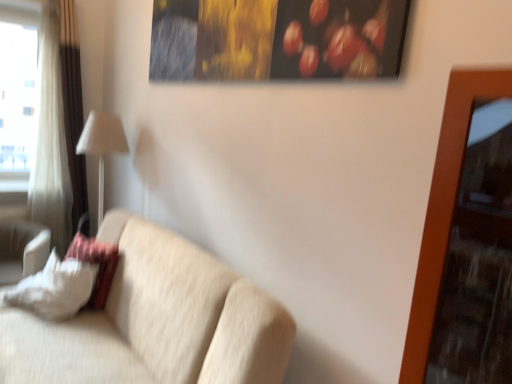
Question: In terms of width, does white fabric curtain at left look wider or thinner when compared to beige fabric couch at center?

Choices:
 (A) wide
 (B) thin

Answer: (B)

Question: Considering the positions of white fabric curtain at left and beige fabric couch at center in the image, is white fabric curtain at left bigger or smaller than beige fabric couch at center?

Choices:
 (A) small
 (B) big

Answer: (A)

Question: Based on their relative distances, which object is nearer to the transparent glass window at left?

Choices:
 (A) white fabric curtain at left
 (B) white fabric lampshade at left
 (C) white fabric pillow at left, the 1th pillow from the right
 (D) beige fabric couch at center
 (E) white soft pillow at lower left, the 2th pillow viewed from the right

Answer: (A)

Question: Which object is the farthest from the white fabric pillow at left, the 2th pillow in the left-to-right sequence?

Choices:
 (A) white fabric lampshade at left
 (B) transparent glass window at left
 (C) white soft pillow at lower left, the 2th pillow viewed from the right
 (D) beige fabric couch at center
 (E) white fabric curtain at left

Answer: (B)